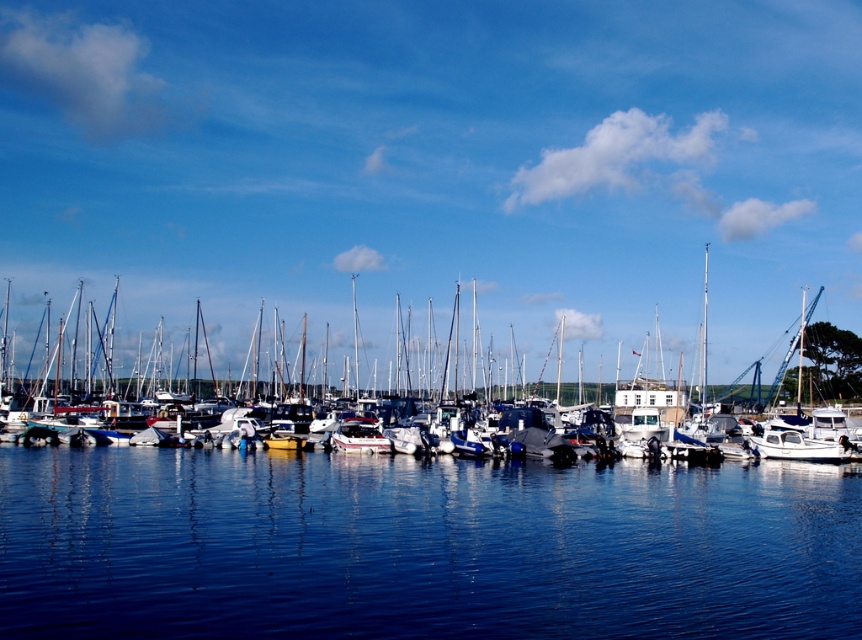
Question: From the image, what is the correct spatial relationship of white matte boat at center in relation to blue smooth water at center?

Choices:
 (A) below
 (B) above

Answer: (B)

Question: Does white matte boat at center have a lesser width compared to blue smooth water at center?

Choices:
 (A) no
 (B) yes

Answer: (A)

Question: From the image, what is the correct spatial relationship of white matte boat at center in relation to blue smooth water at center?

Choices:
 (A) above
 (B) below

Answer: (A)

Question: Which object appears closest to the camera in this image?

Choices:
 (A) white matte boat at center
 (B) blue smooth water at center

Answer: (B)